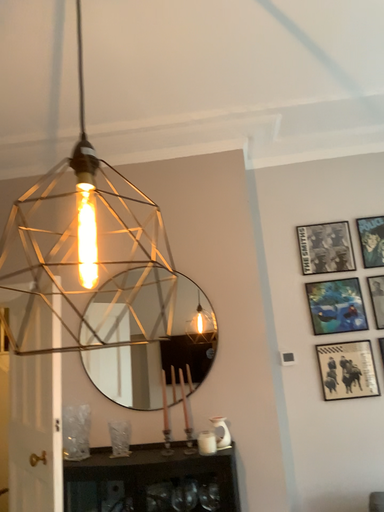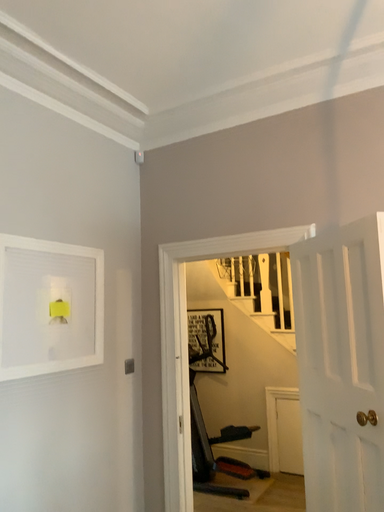
Question: How did the camera likely rotate when shooting the video?

Choices:
 (A) rotated right
 (B) rotated left

Answer: (B)